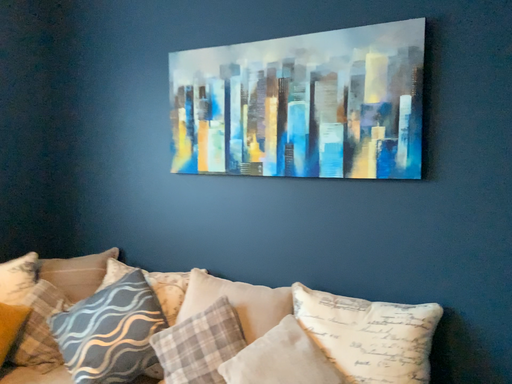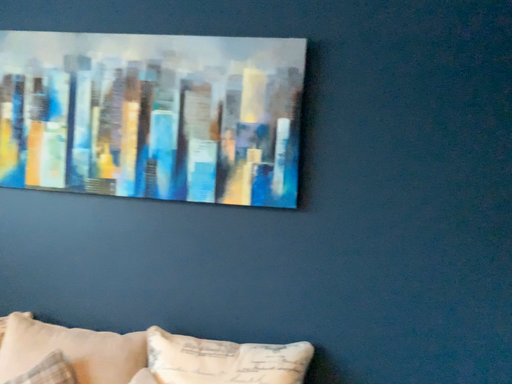
Question: Which way did the camera rotate in the video?

Choices:
 (A) rotated right
 (B) rotated left

Answer: (A)